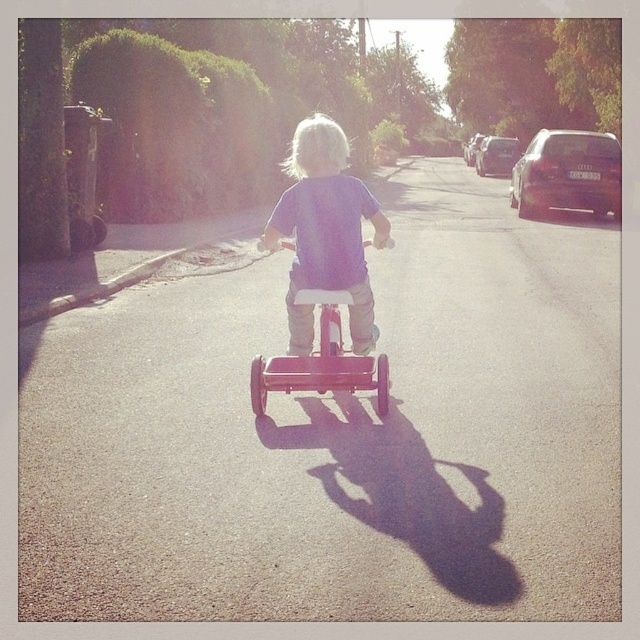
Question: Which point appears closest to the camera in this image?

Choices:
 (A) (589, 166)
 (B) (278, 205)

Answer: (B)

Question: Which of the following is the closest to the observer?

Choices:
 (A) metallic silver car at right
 (B) matte red tricycle at center

Answer: (B)

Question: Estimate the real-world distances between objects in this image. Which object is closer to the purple matte shirt at center?

Choices:
 (A) matte red tricycle at center
 (B) matte black car at upper right

Answer: (A)

Question: Does matte red tricycle at center have a lesser width compared to metallic silver car at right?

Choices:
 (A) yes
 (B) no

Answer: (A)

Question: Is the position of matte black car at upper right less distant than that of metallic silver car at right?

Choices:
 (A) no
 (B) yes

Answer: (B)

Question: Is the position of matte black car at upper right less distant than that of matte red tricycle at center?

Choices:
 (A) no
 (B) yes

Answer: (A)